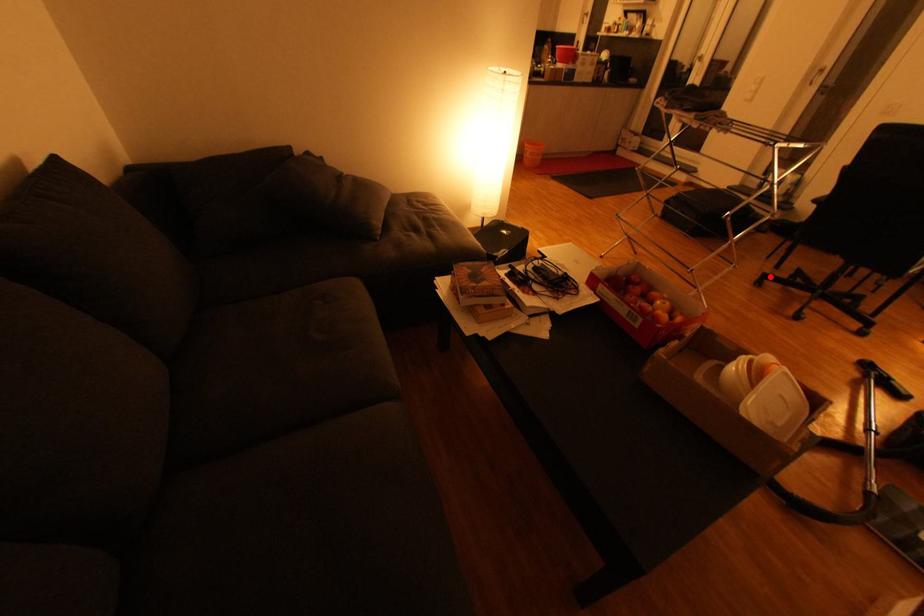
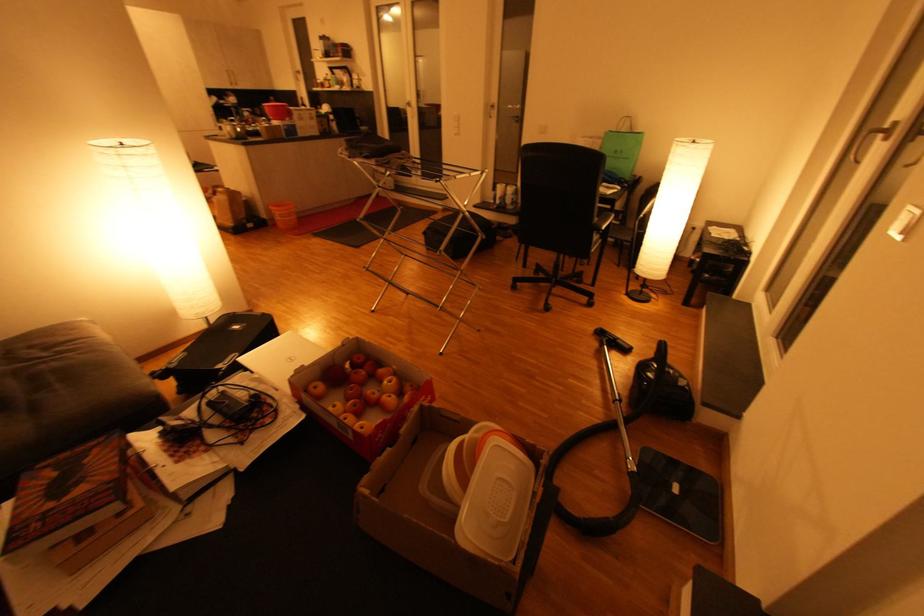
Find the pixel in the second image that matches the highlighted location in the first image.

(520, 281)